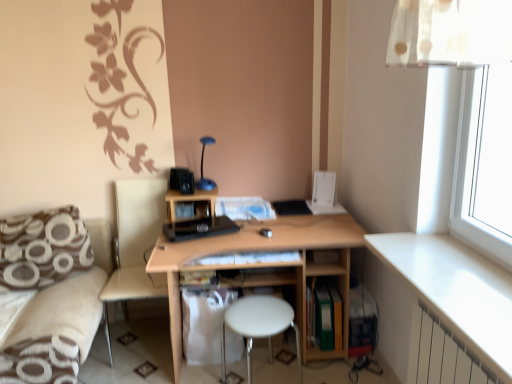
Where is `free point below beige fabric swivel chair at lower left (from a real-world perspective)`? free point below beige fabric swivel chair at lower left (from a real-world perspective) is located at coordinates (145, 342).